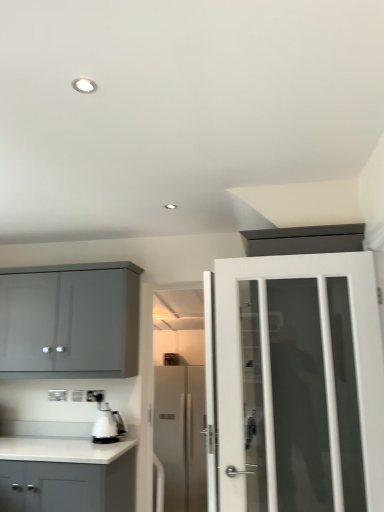
Question: Choose the correct answer: Is satin silver refrigerator at center, acting as the first door starting from the back, inside white matte cabinet at lower left, the second cabinetry when ordered from top to bottom, or outside it?

Choices:
 (A) inside
 (B) outside

Answer: (B)

Question: Is point (168, 397) positioned closer to the camera than point (6, 440)?

Choices:
 (A) closer
 (B) farther

Answer: (B)

Question: Estimate the real-world distances between objects in this image. Which object is farther from the white glossy coffee machine at lower left?

Choices:
 (A) satin silver refrigerator at center, acting as the first door starting from the back
 (B) white glass door at right, the 2th door when ordered from bottom to top
 (C) matte gray cabinet at upper left, the 1th cabinetry positioned from the top
 (D) white plastic electric outlet at lower center
 (E) white matte cabinet at lower left, the second cabinetry when ordered from top to bottom

Answer: (A)

Question: Considering the real-world distances, which object is farthest from the satin silver refrigerator at center, which is the 1th door from bottom to top?

Choices:
 (A) white plastic electric outlet at lower center
 (B) white glossy coffee machine at lower left
 (C) white matte cabinet at lower left, which appears as the first cabinetry when ordered from the bottom
 (D) white glass door at right, acting as the 1th door starting from the front
 (E) matte gray cabinet at upper left, acting as the second cabinetry starting from the bottom

Answer: (D)